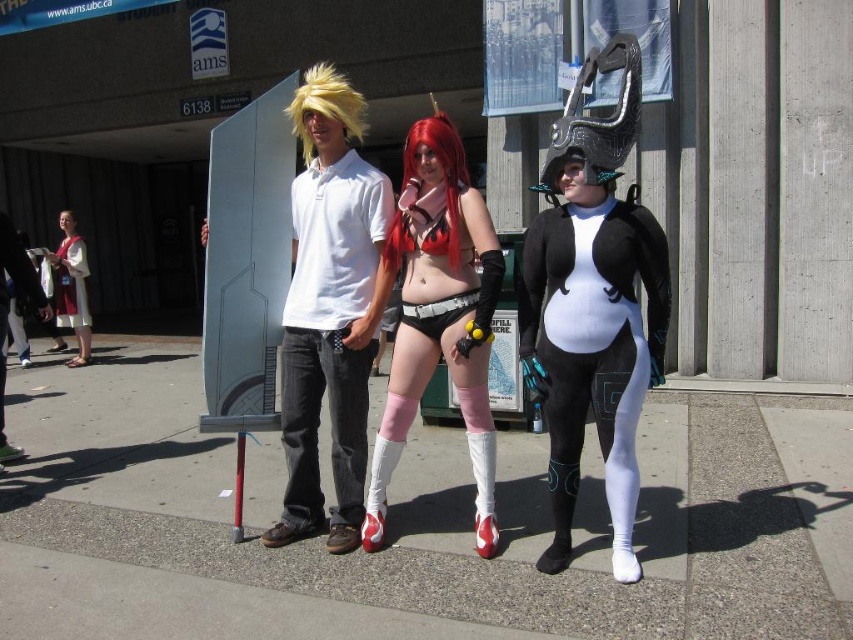
Question: Which of the following is the farthest from the observer?

Choices:
 (A) (550, 436)
 (B) (646, 276)

Answer: (A)

Question: Estimate the real-world distances between objects in this image. Which object is farther from the matte white dress at left?

Choices:
 (A) shiny red wig at center
 (B) matte black shorts at center

Answer: (A)

Question: Among these points, which one is nearest to the camera?

Choices:
 (A) (386, 253)
 (B) (57, 296)
 (C) (358, 97)
 (D) (544, 166)

Answer: (D)

Question: Is matte black and white bodysuit at center below matte white dress at left?

Choices:
 (A) no
 (B) yes

Answer: (B)

Question: Does matte black and white bodysuit at center have a lesser width compared to shiny red wig at center?

Choices:
 (A) no
 (B) yes

Answer: (A)

Question: Is shiny red wig at center further to the viewer compared to matte white robe at center?

Choices:
 (A) no
 (B) yes

Answer: (A)